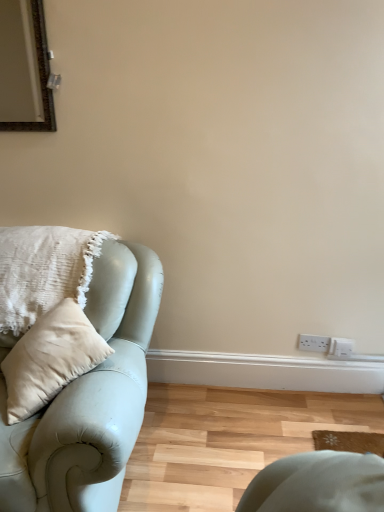
Question: From the image's perspective, relative to white plastic electric outlet at lower right, is sage green leather studio couch at left above or below?

Choices:
 (A) below
 (B) above

Answer: (B)

Question: Is sage green leather studio couch at left taller or shorter than white plastic electric outlet at lower right?

Choices:
 (A) tall
 (B) short

Answer: (A)

Question: Considering the real-world distances, which object is closest to the white plastic electric outlet at lower right?

Choices:
 (A) sage green leather studio couch at left
 (B) white textured cushion at left

Answer: (A)

Question: Estimate the real-world distances between objects in this image. Which object is closer to the sage green leather studio couch at left?

Choices:
 (A) white textured cushion at left
 (B) white plastic electric outlet at lower right

Answer: (A)